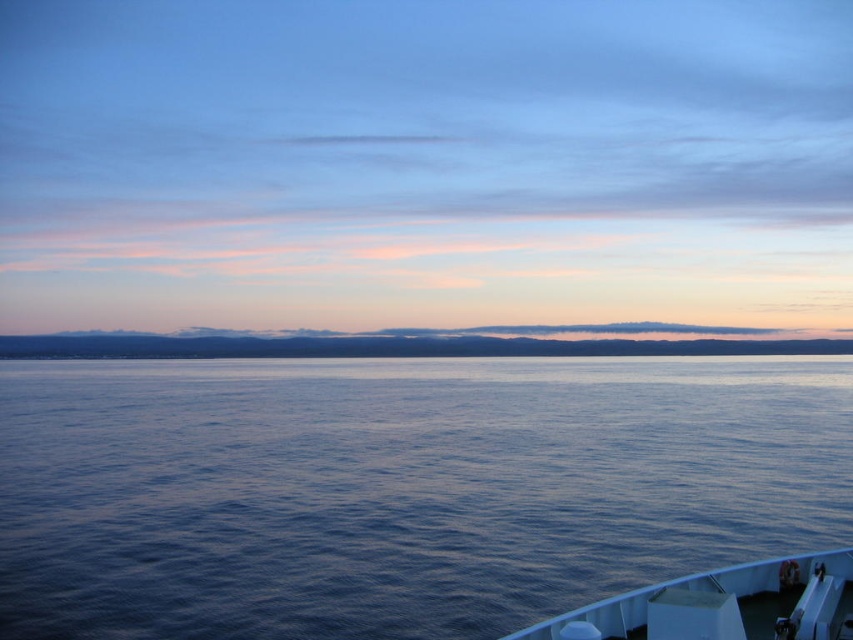
Between white glossy boat at lower right and blue matte horizon at center, which one has more height?

Standing taller between the two is blue matte horizon at center.

Find the location of a particular element. This screenshot has height=640, width=853. white glossy boat at lower right is located at coordinates (723, 604).

Does point (821, 637) come farther from viewer compared to point (415, 353)?

No, it is not.

Image resolution: width=853 pixels, height=640 pixels. I want to click on white glossy boat at lower right, so click(723, 604).

Can you confirm if blue smooth water at center is bigger than white glossy boat at lower right?

Yes.

Is point (344, 609) closer to viewer compared to point (722, 589)?

No, (344, 609) is behind (722, 589).

Identify the location of blue smooth water at center. This screenshot has height=640, width=853. (399, 488).

Is point (281, 515) positioned after point (190, 344)?

No, it is in front of (190, 344).

Is blue smooth water at center bigger than blue matte horizon at center?

Actually, blue smooth water at center might be smaller than blue matte horizon at center.

Between point (3, 545) and point (83, 339), which one is positioned behind?

Point (83, 339)

Image resolution: width=853 pixels, height=640 pixels. What are the coordinates of `blue smooth water at center` in the screenshot? It's located at (399, 488).